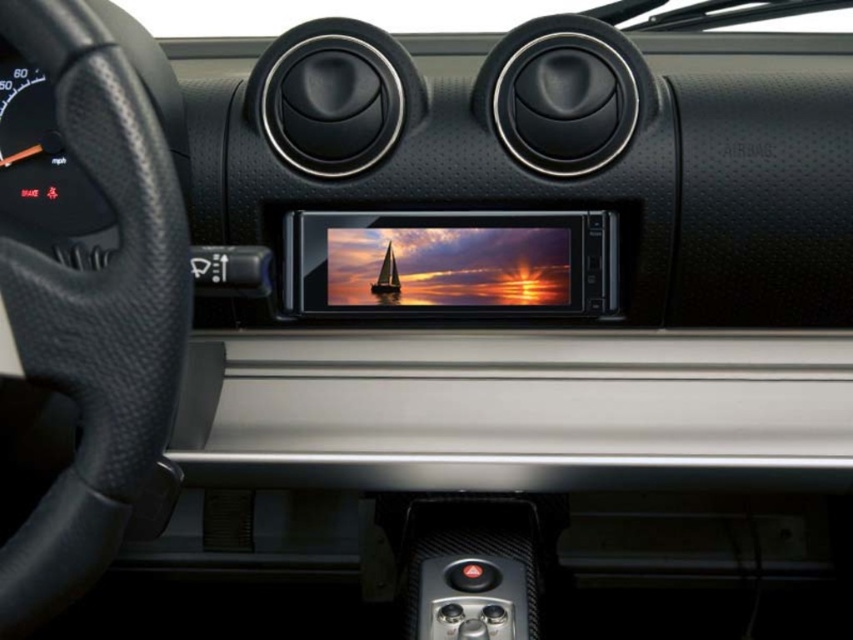
Is black leather steering wheel at left bigger than satin black sailboat at center?

Yes, black leather steering wheel at left is bigger than satin black sailboat at center.

Is black leather steering wheel at left above satin black sailboat at center?

No, black leather steering wheel at left is not above satin black sailboat at center.

Which is in front, point (149, 365) or point (389, 266)?

Positioned in front is point (149, 365).

The width and height of the screenshot is (853, 640). Identify the location of black leather steering wheel at left. (94, 312).